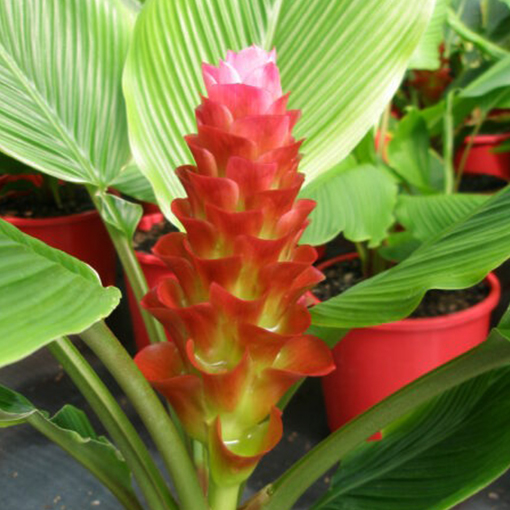
In order to click on 1 flower in this screenshot , I will do `click(213, 207)`.